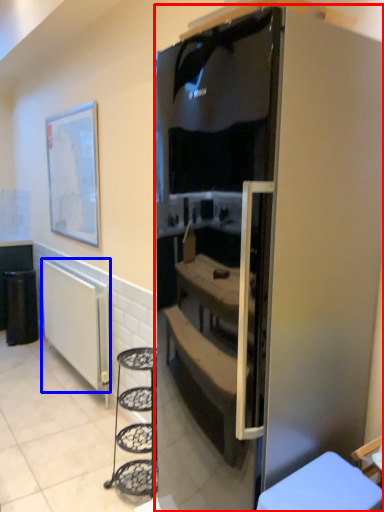
Question: Among these objects, which one is farthest to the camera, refrigerator (highlighted by a red box) or radiator (highlighted by a blue box)?

Choices:
 (A) refrigerator
 (B) radiator

Answer: (B)